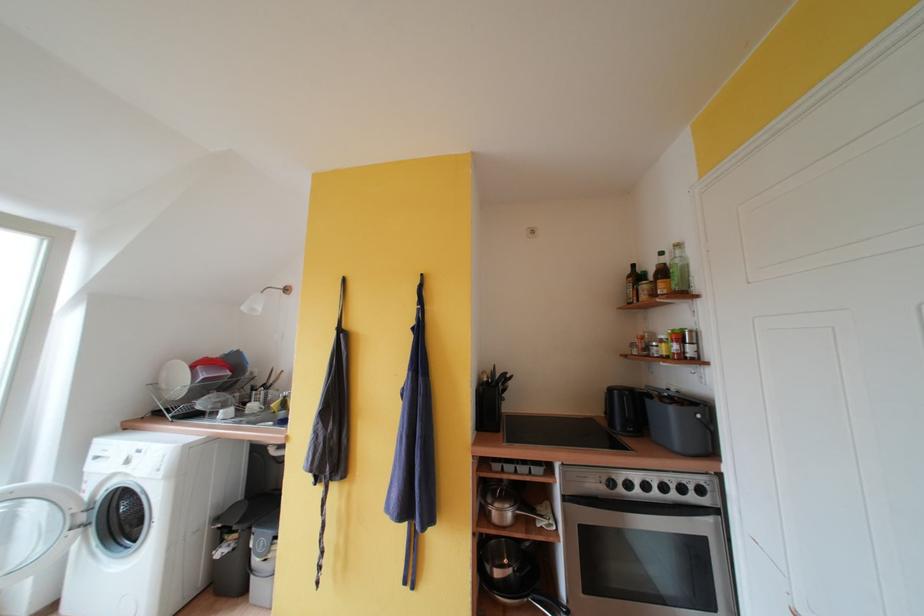
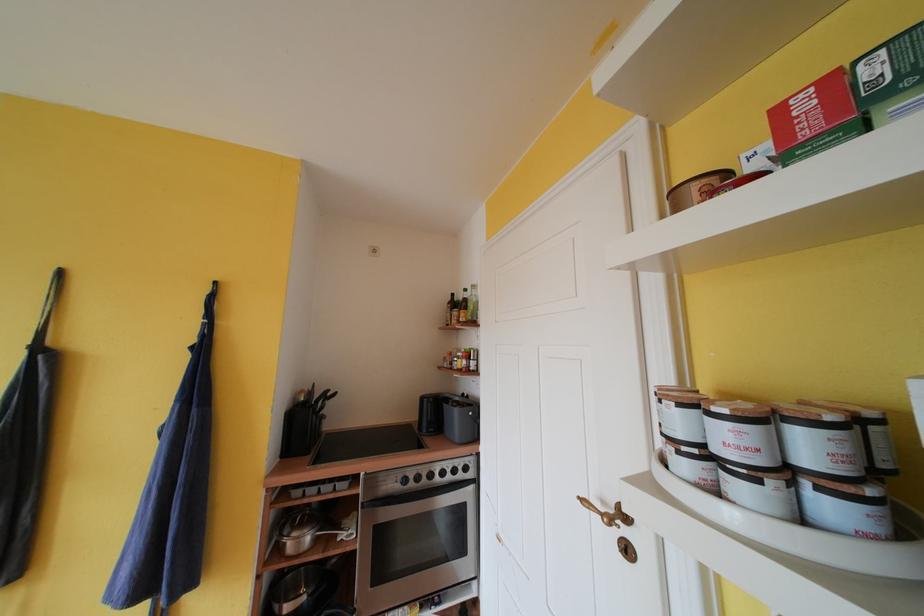
The point at (495,504) is marked in the first image. Where is the corresponding point in the second image?

(293, 535)